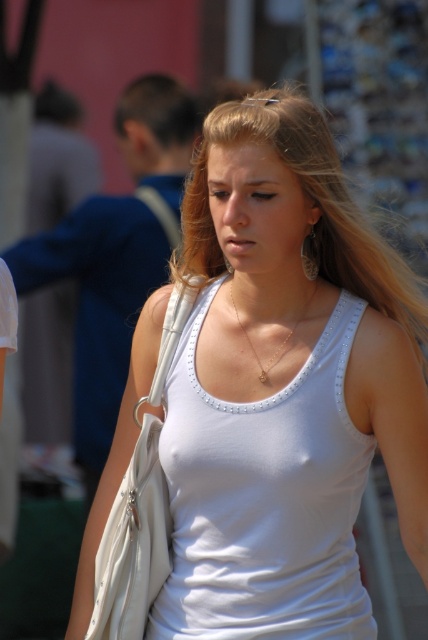
Question: Is dark brown hair at upper left smaller than gold chain necklace at center?

Choices:
 (A) yes
 (B) no

Answer: (B)

Question: Which point is closer to the camera taking this photo?

Choices:
 (A) (365, 464)
 (B) (154, 416)
 (C) (128, 106)

Answer: (A)

Question: Which point is closer to the camera?

Choices:
 (A) dark brown hair at upper left
 (B) white fabric tank top at center
 (C) gold chain necklace at center

Answer: (B)

Question: Is white fabric tank top at center below gold chain necklace at center?

Choices:
 (A) yes
 (B) no

Answer: (A)

Question: Is white fabric shoulder bag at center in front of silver metallic earring at center?

Choices:
 (A) yes
 (B) no

Answer: (A)

Question: Which point appears farthest from the camera in this image?

Choices:
 (A) (303, 316)
 (B) (252, 392)
 (C) (145, 124)
 (D) (155, 502)

Answer: (C)